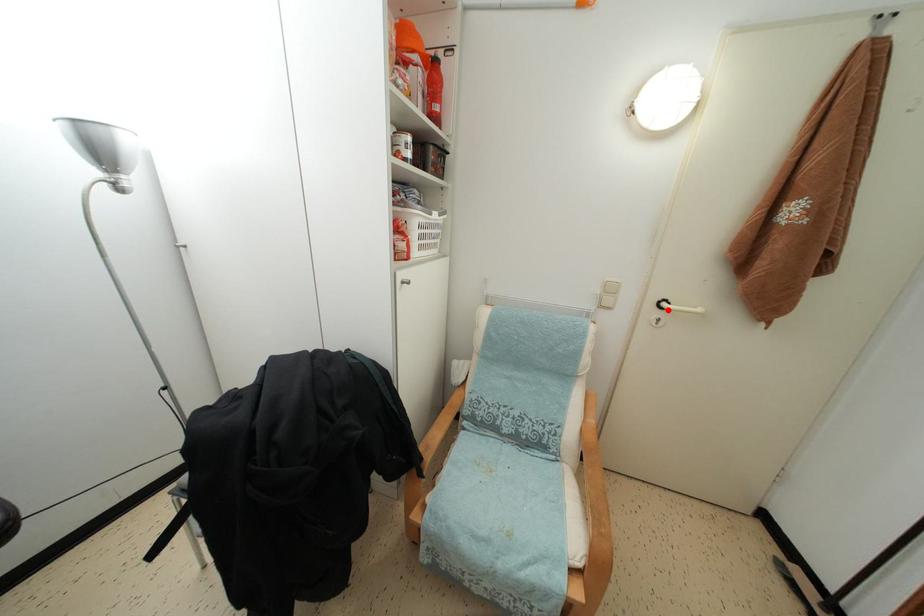
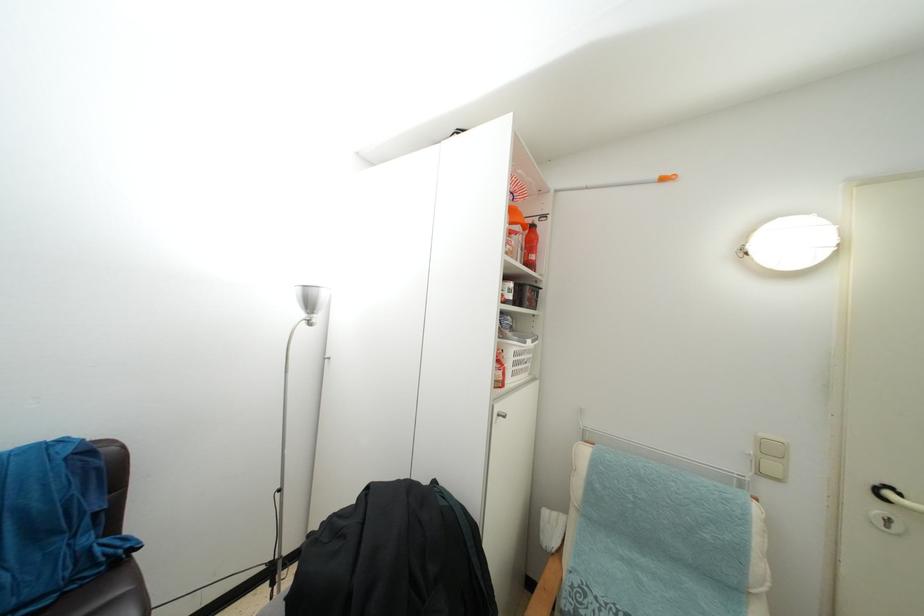
Question: A red point is marked in image1. In image2, is the corresponding 3D point closer to the camera or farther? Reply with the corresponding letter.

Choices:
 (A) The corresponding 3D point is closer.
 (B) The corresponding 3D point is farther.

Answer: (A)